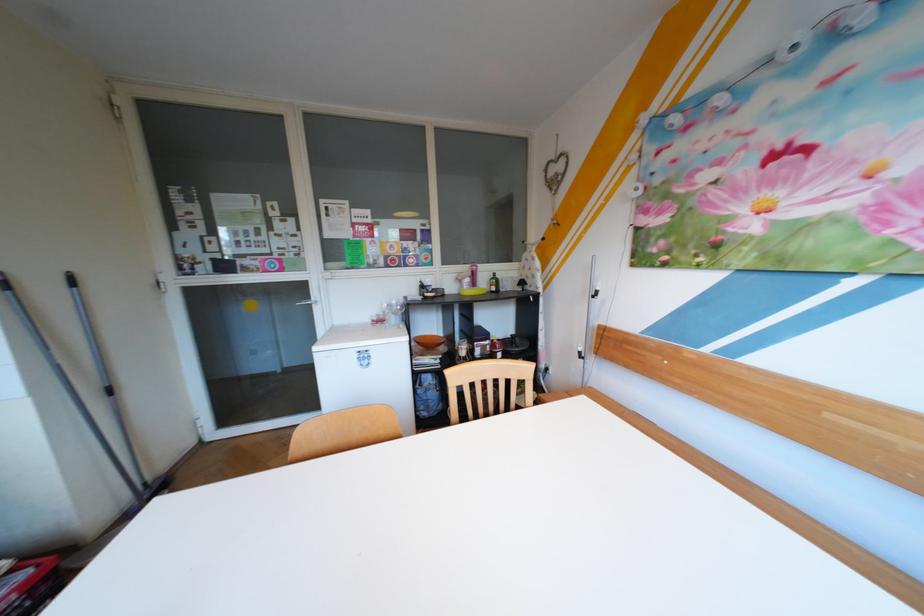
Find where to press the pink bottle sprayer. Please return your answer as a coordinate pair (x, y).

(472, 275)